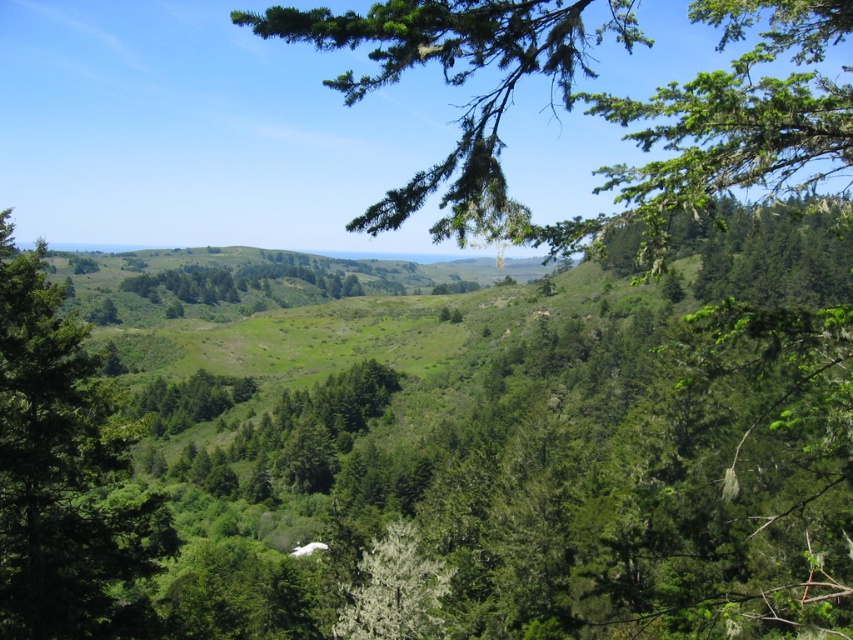
Question: Considering the real-world distances, which object is farthest from the green leafy branch at upper center?

Choices:
 (A) green leafy tree at center
 (B) white fluffy tree at center

Answer: (A)

Question: Which object is positioned farthest from the white fluffy tree at center?

Choices:
 (A) green leafy branch at upper center
 (B) green leafy tree at center

Answer: (A)

Question: Can you confirm if green leafy tree at center is smaller than white fluffy tree at center?

Choices:
 (A) no
 (B) yes

Answer: (A)

Question: Where is green leafy branch at upper center located in relation to white fluffy tree at center in the image?

Choices:
 (A) left
 (B) right

Answer: (B)

Question: Does green leafy branch at upper center appear over green leafy tree at center?

Choices:
 (A) yes
 (B) no

Answer: (A)

Question: Which object is farther from the camera taking this photo?

Choices:
 (A) green leafy branch at upper center
 (B) white fluffy tree at center
 (C) green leafy tree at center

Answer: (B)